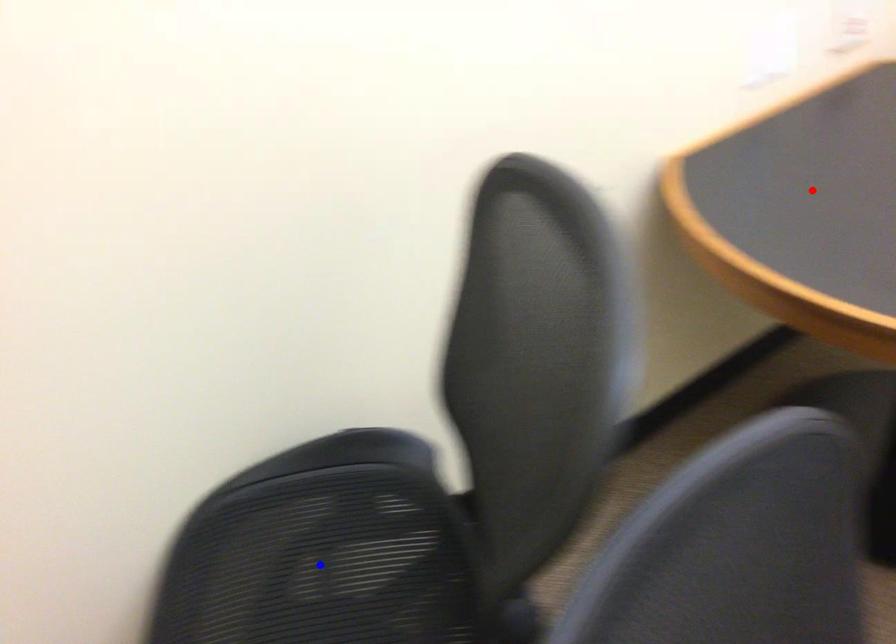
Question: Two points are marked on the image. Which point is closer to the camera?

Choices:
 (A) Blue point is closer.
 (B) Red point is closer.

Answer: (A)